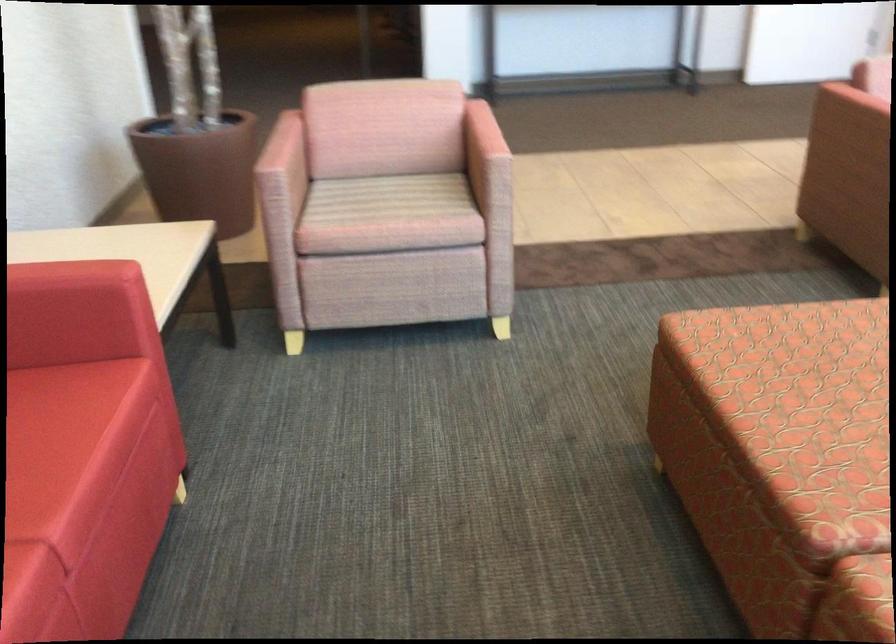
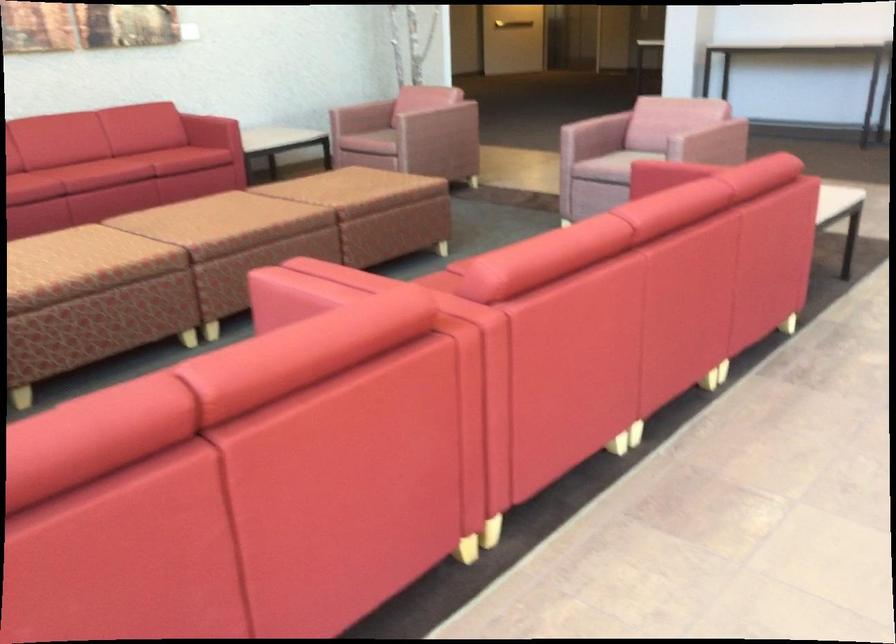
Question: I am providing you with two images of the same scene from different viewpoints. Please identify which objects are invisible in image2.

Choices:
 (A) red sofa armrest
 (B) red sofa sitting surface
 (C) pink chair armrest
 (D) lamp button

Answer: (C)